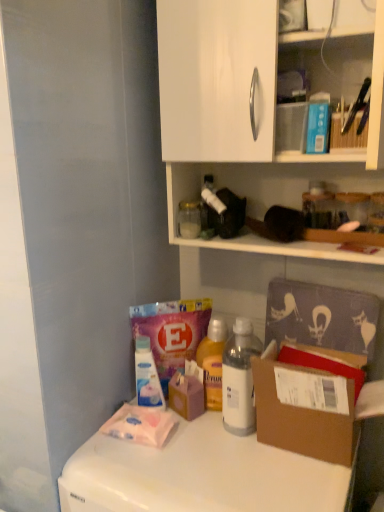
This screenshot has width=384, height=512. I want to click on vacant space situated on the left part of white plastic bottle at center, arranged as the 1th bottle when viewed from the right, so click(x=186, y=441).